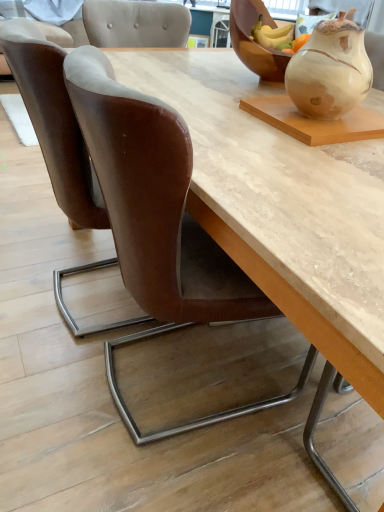
I want to click on free space to the left of matte ceramic vase at upper right, so click(x=236, y=115).